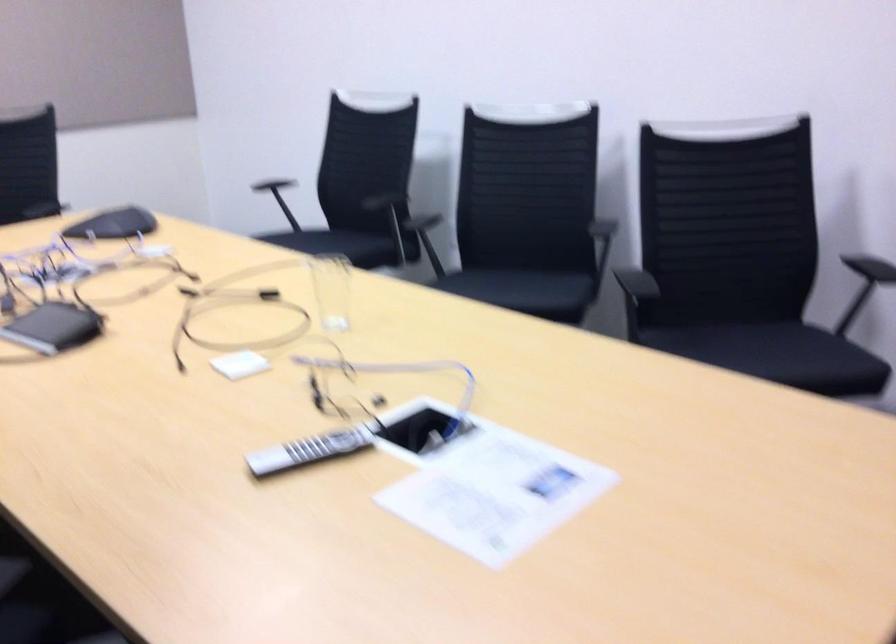
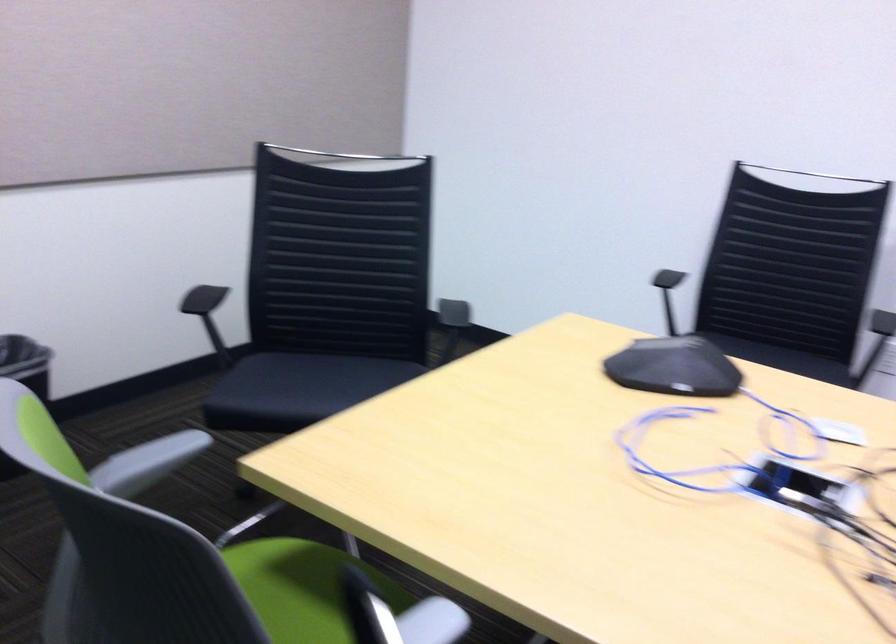
The images are taken continuously from a first-person perspective. In which direction are you moving?

The movement direction of the cameraman is left, forward.